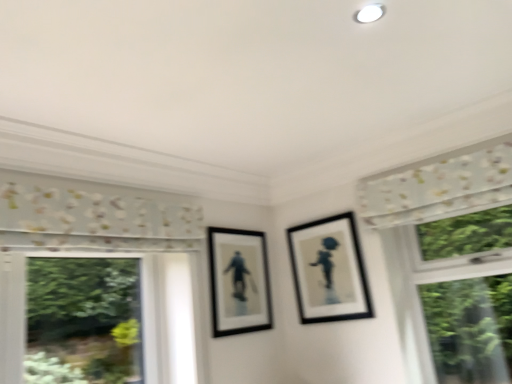
Question: Does white floral fabric at upper right have a lesser height compared to matte black picture frame at center, which is counted as the second picture frame, starting from the right?

Choices:
 (A) no
 (B) yes

Answer: (B)

Question: Is the depth of white floral fabric at upper right less than that of matte black picture frame at center, which ranks as the 1th picture frame in left-to-right order?

Choices:
 (A) no
 (B) yes

Answer: (B)

Question: Considering the relative sizes of white floral fabric at upper right and matte black picture frame at center, which is counted as the second picture frame, starting from the right, in the image provided, is white floral fabric at upper right wider than matte black picture frame at center, which is counted as the second picture frame, starting from the right,?

Choices:
 (A) no
 (B) yes

Answer: (B)

Question: From a real-world perspective, is white floral fabric at upper right on matte black picture frame at center, which is counted as the second picture frame, starting from the right?

Choices:
 (A) no
 (B) yes

Answer: (B)

Question: Is white floral fabric at upper right at the left side of matte black picture frame at center, which ranks as the 1th picture frame in left-to-right order?

Choices:
 (A) yes
 (B) no

Answer: (B)

Question: Is white floral fabric at upper right further to camera compared to matte black picture frame at center, which is counted as the second picture frame, starting from the right?

Choices:
 (A) no
 (B) yes

Answer: (A)

Question: Does matte black picture frame at center, which is counted as the second picture frame, starting from the right, come behind black matte picture frame at upper right, which is counted as the first picture frame, starting from the right?

Choices:
 (A) no
 (B) yes

Answer: (A)

Question: Considering the relative positions of matte black picture frame at center, which is counted as the second picture frame, starting from the right, and black matte picture frame at upper right, which is counted as the first picture frame, starting from the right, in the image provided, is matte black picture frame at center, which is counted as the second picture frame, starting from the right, in front of black matte picture frame at upper right, which is counted as the first picture frame, starting from the right,?

Choices:
 (A) yes
 (B) no

Answer: (A)

Question: Can you confirm if matte black picture frame at center, which ranks as the 1th picture frame in left-to-right order, is smaller than black matte picture frame at upper right, which is counted as the first picture frame, starting from the right?

Choices:
 (A) yes
 (B) no

Answer: (A)

Question: From a real-world perspective, is matte black picture frame at center, which is counted as the second picture frame, starting from the right, positioned under black matte picture frame at upper right, which ranks as the second picture frame in left-to-right order, based on gravity?

Choices:
 (A) no
 (B) yes

Answer: (B)

Question: Can you confirm if matte black picture frame at center, which is counted as the second picture frame, starting from the right, is positioned to the right of black matte picture frame at upper right, which ranks as the second picture frame in left-to-right order?

Choices:
 (A) no
 (B) yes

Answer: (A)

Question: Is matte black picture frame at center, which ranks as the 1th picture frame in left-to-right order, not inside black matte picture frame at upper right, which ranks as the second picture frame in left-to-right order?

Choices:
 (A) no
 (B) yes

Answer: (B)

Question: Can you confirm if matte black picture frame at center, which ranks as the 1th picture frame in left-to-right order, is shorter than white floral fabric at upper right?

Choices:
 (A) yes
 (B) no

Answer: (B)